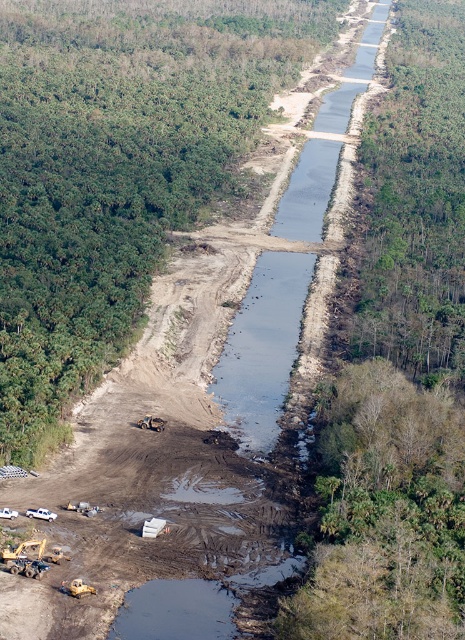
Question: Is yellow rubber at lower left to the right of metallic yellow excavator at lower left from the viewer's perspective?

Choices:
 (A) yes
 (B) no

Answer: (B)

Question: Among these objects, which one is nearest to the camera?

Choices:
 (A) metallic yellow excavator at lower left
 (B) yellow rubber at lower left

Answer: (B)

Question: Which point appears farthest from the camera in this image?

Choices:
 (A) (67, 586)
 (B) (161, 426)

Answer: (B)

Question: Can you confirm if yellow rubber at lower left is bigger than metallic yellow excavator at lower left?

Choices:
 (A) yes
 (B) no

Answer: (B)

Question: Which of the following is the closest to the observer?

Choices:
 (A) (70, 593)
 (B) (152, 417)

Answer: (A)

Question: Is yellow rubber at lower left closer to camera compared to metallic yellow excavator at lower left?

Choices:
 (A) yes
 (B) no

Answer: (A)